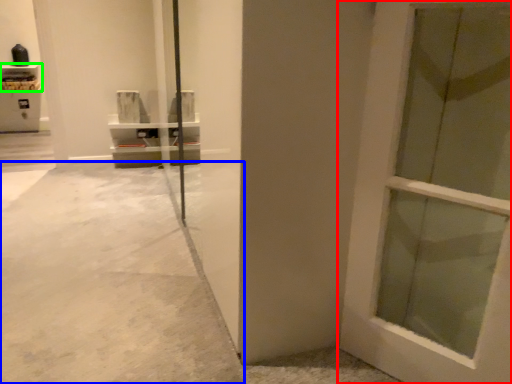
Question: Estimate the real-world distances between objects in this image. Which object is farther from door (highlighted by a red box), concrete (highlighted by a blue box) or shelf (highlighted by a green box)?

Choices:
 (A) concrete
 (B) shelf

Answer: (B)